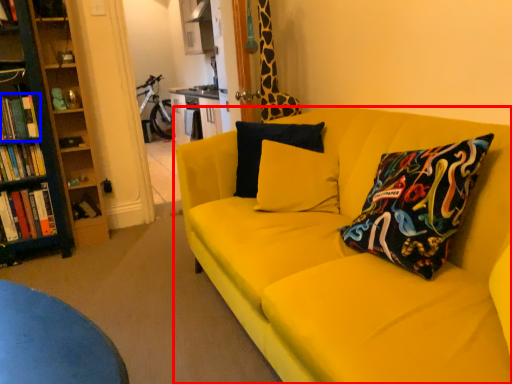
Question: Which object appears closest to the camera in this image, studio couch (highlighted by a red box) or book (highlighted by a blue box)?

Choices:
 (A) studio couch
 (B) book

Answer: (A)